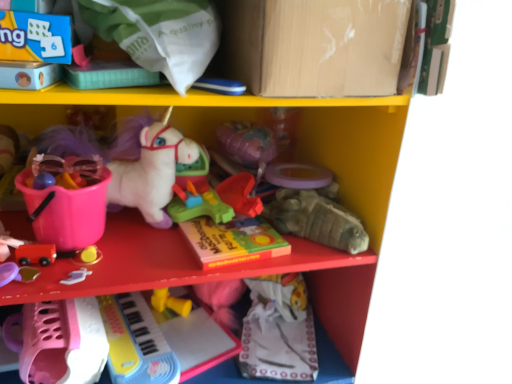
Question: Would you say matte cardboard box at upper center is part of matte plastic book at center's contents?

Choices:
 (A) no
 (B) yes

Answer: (A)

Question: Is matte plastic book at center at the right side of matte cardboard box at upper center?

Choices:
 (A) no
 (B) yes

Answer: (A)

Question: From a real-world perspective, is matte plastic book at center below matte cardboard box at upper center?

Choices:
 (A) no
 (B) yes

Answer: (B)

Question: Is matte plastic book at center bigger than matte cardboard box at upper center?

Choices:
 (A) no
 (B) yes

Answer: (A)

Question: Does matte plastic book at center come in front of matte cardboard box at upper center?

Choices:
 (A) no
 (B) yes

Answer: (A)

Question: From their relative heights in the image, would you say matte gray turtle at center right, positioned as the third toy in top-to-bottom order, is taller or shorter than rubberized plastic toy at center, positioned as the 1th toy in top-to-bottom order?

Choices:
 (A) tall
 (B) short

Answer: (A)

Question: Considering the positions of point (344, 243) and point (219, 183), is point (344, 243) closer or farther from the camera than point (219, 183)?

Choices:
 (A) closer
 (B) farther

Answer: (A)

Question: Is matte gray turtle at center right, which is counted as the 4th toy, starting from the bottom, situated inside rubberized plastic toy at center, positioned as the 1th toy in top-to-bottom order, or outside?

Choices:
 (A) outside
 (B) inside

Answer: (A)

Question: From a real-world perspective, is matte gray turtle at center right, which is counted as the 4th toy, starting from the bottom, positioned above or below rubberized plastic toy at center, positioned as the 1th toy in top-to-bottom order?

Choices:
 (A) above
 (B) below

Answer: (B)

Question: In the image, is yellow rubber toy at lower center, which is counted as the 5th toy, starting from the top, on the left side or the right side of smooth wooden car at lower left, which is the third toy from bottom to top?

Choices:
 (A) right
 (B) left

Answer: (A)

Question: Is point coord(158,291) positioned closer to the camera than point coord(53,256)?

Choices:
 (A) farther
 (B) closer

Answer: (A)

Question: From a real-world perspective, relative to smooth wooden car at lower left, which is the third toy from bottom to top, is yellow rubber toy at lower center, which is counted as the 5th toy, starting from the top, vertically above or below?

Choices:
 (A) above
 (B) below

Answer: (B)

Question: Is yellow rubber toy at lower center, the second toy ordered from the bottom, taller or shorter than smooth wooden car at lower left, the fourth toy when ordered from top to bottom?

Choices:
 (A) short
 (B) tall

Answer: (B)

Question: Would you say rubberized plastic toy at center, arranged as the 5th toy when ordered from the bottom, is to the left or to the right of pink plastic bucket at left in the picture?

Choices:
 (A) left
 (B) right

Answer: (B)

Question: Is rubberized plastic toy at center, arranged as the 5th toy when ordered from the bottom, spatially inside pink plastic bucket at left, or outside of it?

Choices:
 (A) outside
 (B) inside

Answer: (A)